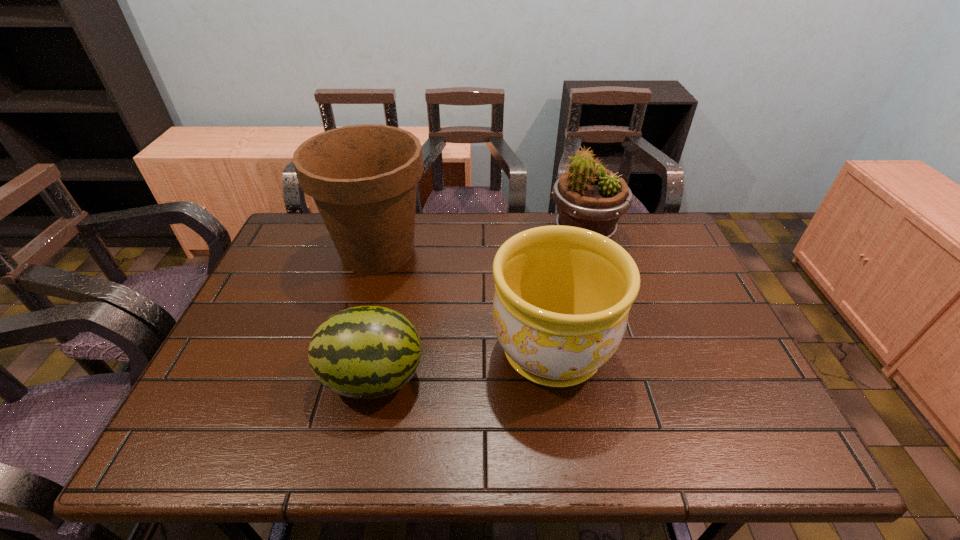
Where is `free space at the near edge of the desktop`? free space at the near edge of the desktop is located at coordinates click(348, 434).

I want to click on blank area at the left edge, so click(x=243, y=330).

Image resolution: width=960 pixels, height=540 pixels. What are the coordinates of `vacant space at the right edge` in the screenshot? It's located at (700, 292).

Locate an element on the screen. This screenshot has height=540, width=960. free area in between the shortest flowerpot and the leftmost flowerpot is located at coordinates (465, 302).

Where is `free space between the second shortest object and the leftmost flowerpot`? The height and width of the screenshot is (540, 960). free space between the second shortest object and the leftmost flowerpot is located at coordinates (465, 302).

I want to click on free area in between the nearest flowerpot and the shortest object, so click(463, 364).

Where is `vacant area that lies between the shortest object and the third tallest object`? The width and height of the screenshot is (960, 540). vacant area that lies between the shortest object and the third tallest object is located at coordinates (463, 364).

The width and height of the screenshot is (960, 540). In order to click on object that stands as the third closest to the shortest object in this screenshot , I will do `click(589, 196)`.

Locate which object ranks second in proximity to the nearest flowerpot. Please provide its 2D coordinates. Your answer should be formatted as a tuple, i.e. [(x, y)], where the tuple contains the x and y coordinates of a point satisfying the conditions above.

[(363, 178)]

You are a GUI agent. You are given a task and a screenshot of the screen. Output one action in this format:
    pyautogui.click(x=<x>, y=<y>)
    Task: Click on the flowerpot that stands as the second closest to the leftmost flowerpot
    
    Given the screenshot: What is the action you would take?
    pyautogui.click(x=589, y=196)